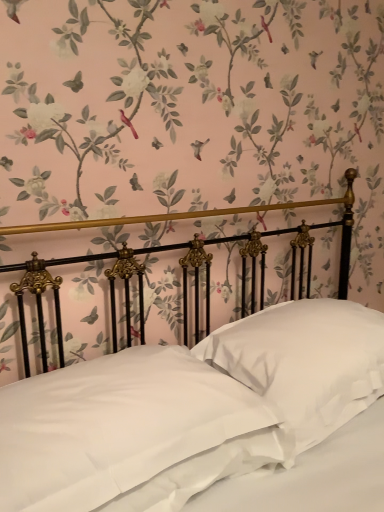
Locate an element on the screen. white satin pillow at center, the second pillow when ordered from left to right is located at coordinates (305, 362).

What is the approximate width of white satin pillow at center, which ranks as the 2th pillow in right-to-left order?

white satin pillow at center, which ranks as the 2th pillow in right-to-left order, is 19.43 inches wide.

The height and width of the screenshot is (512, 384). In order to click on white satin pillow at center, the second pillow when ordered from left to right in this screenshot , I will do `click(305, 362)`.

Is white satin pillow at center, the second pillow when ordered from left to right, inside or outside of white satin pillow at center, which appears as the first pillow when viewed from the left?

white satin pillow at center, the second pillow when ordered from left to right, is outside white satin pillow at center, which appears as the first pillow when viewed from the left.

Is white satin pillow at center, which is the 1th pillow in right-to-left order, beside white satin pillow at center, which appears as the first pillow when viewed from the left?

There is a gap between white satin pillow at center, which is the 1th pillow in right-to-left order, and white satin pillow at center, which appears as the first pillow when viewed from the left.

From the image's perspective, which object appears higher, white satin pillow at center, which is the 1th pillow in right-to-left order, or white satin pillow at center, which appears as the first pillow when viewed from the left?

white satin pillow at center, which is the 1th pillow in right-to-left order, is shown above in the image.

Is the depth of satin white bed at center less than that of white satin pillow at center, which ranks as the 2th pillow in right-to-left order?

Yes, it is in front of white satin pillow at center, which ranks as the 2th pillow in right-to-left order.

Which is closer to the camera, (268, 461) or (52, 410)?

The point (52, 410) is closer.

Is satin white bed at center at the left side of white satin pillow at center, which appears as the first pillow when viewed from the left?

No, satin white bed at center is not to the left of white satin pillow at center, which appears as the first pillow when viewed from the left.

Consider the image. Which is closer to the camera, [28,412] or [197,321]?

The point [28,412] is more forward.

Do you think white satin pillow at center, which ranks as the 2th pillow in right-to-left order, is within satin white bed at center, or outside of it?

white satin pillow at center, which ranks as the 2th pillow in right-to-left order, is located inside satin white bed at center.

Based on their sizes in the image, would you say white satin pillow at center, which appears as the first pillow when viewed from the left, is bigger or smaller than satin white bed at center?

Considering their sizes, white satin pillow at center, which appears as the first pillow when viewed from the left, takes up less space than satin white bed at center.

Does white satin pillow at center, which appears as the first pillow when viewed from the left, have a greater height compared to satin white bed at center?

Incorrect, the height of white satin pillow at center, which appears as the first pillow when viewed from the left, is not larger of that of satin white bed at center.

Is satin white bed at center inside the boundaries of white satin pillow at center, which is the 1th pillow in right-to-left order, or outside?

satin white bed at center cannot be found inside white satin pillow at center, which is the 1th pillow in right-to-left order.

Find the location of a particular element. Image resolution: width=384 pixels, height=512 pixels. the 1st pillow positioned below the satin white bed at center (from a real-world perspective) is located at coordinates (305, 362).

In terms of size, does satin white bed at center appear bigger or smaller than white satin pillow at center, which is the 1th pillow in right-to-left order?

satin white bed at center is bigger than white satin pillow at center, which is the 1th pillow in right-to-left order.

Is point (62, 467) farther from camera compared to point (361, 350)?

That is False.

Which is less distant, (330, 368) or (177, 478)?

Clearly, point (330, 368) is more distant from the camera than point (177, 478).

From a real-world perspective, does white satin pillow at center, the second pillow when ordered from left to right, stand above satin white bed at center?

No, from a real-world perspective, white satin pillow at center, the second pillow when ordered from left to right, is not over satin white bed at center

Between white satin pillow at center, the second pillow when ordered from left to right, and satin white bed at center, which one has smaller width?

white satin pillow at center, the second pillow when ordered from left to right.

Is point (154, 376) in front of point (356, 329)?

Yes, it is in front of point (356, 329).

Considering the relative positions of white satin pillow at center, which appears as the first pillow when viewed from the left, and white satin pillow at center, which is the 1th pillow in right-to-left order, in the image provided, is white satin pillow at center, which appears as the first pillow when viewed from the left, to the left or to the right of white satin pillow at center, which is the 1th pillow in right-to-left order,?

white satin pillow at center, which appears as the first pillow when viewed from the left, is positioned on white satin pillow at center, which is the 1th pillow in right-to-left order,'s left side.

Locate an element on the screen. Image resolution: width=384 pixels, height=512 pixels. pillow in front of the white satin pillow at center, the second pillow when ordered from left to right is located at coordinates (131, 433).

Does white satin pillow at center, which appears as the first pillow when viewed from the left, have a greater width compared to white satin pillow at center, which is the 1th pillow in right-to-left order?

Yes.

Image resolution: width=384 pixels, height=512 pixels. What are the coordinates of `pillow above the white satin pillow at center, which ranks as the 2th pillow in right-to-left order (from a real-world perspective)` in the screenshot? It's located at (305, 362).

Where is `pillow that is the 2nd one when counting downward from the satin white bed at center (from the image's perspective)`? The image size is (384, 512). pillow that is the 2nd one when counting downward from the satin white bed at center (from the image's perspective) is located at coordinates coord(131,433).

When comparing their distances from satin white bed at center, does white satin pillow at center, which appears as the first pillow when viewed from the left, or white satin pillow at center, which is the 1th pillow in right-to-left order, seem further?

Based on the image, white satin pillow at center, which is the 1th pillow in right-to-left order, appears to be further to satin white bed at center.

Looking at the image, which one is located further to white satin pillow at center, which is the 1th pillow in right-to-left order, white satin pillow at center, which appears as the first pillow when viewed from the left, or satin white bed at center?

white satin pillow at center, which appears as the first pillow when viewed from the left.

Looking at the image, which one is located further to satin white bed at center, white satin pillow at center, the second pillow when ordered from left to right, or white satin pillow at center, which ranks as the 2th pillow in right-to-left order?

white satin pillow at center, the second pillow when ordered from left to right, is further to satin white bed at center.

Considering their positions, is satin white bed at center positioned closer to white satin pillow at center, which appears as the first pillow when viewed from the left, than white satin pillow at center, which is the 1th pillow in right-to-left order?

satin white bed at center is positioned closer to the anchor white satin pillow at center, which appears as the first pillow when viewed from the left.

Estimate the real-world distances between objects in this image. Which object is further from white satin pillow at center, which ranks as the 2th pillow in right-to-left order, white satin pillow at center, the second pillow when ordered from left to right, or satin white bed at center?

white satin pillow at center, the second pillow when ordered from left to right, is further to white satin pillow at center, which ranks as the 2th pillow in right-to-left order.

Which object lies further to the anchor point white satin pillow at center, which is the 1th pillow in right-to-left order, satin white bed at center or white satin pillow at center, which appears as the first pillow when viewed from the left?

white satin pillow at center, which appears as the first pillow when viewed from the left.

This screenshot has width=384, height=512. Identify the location of pillow between satin white bed at center and white satin pillow at center, the second pillow when ordered from left to right, from front to back. (131, 433).